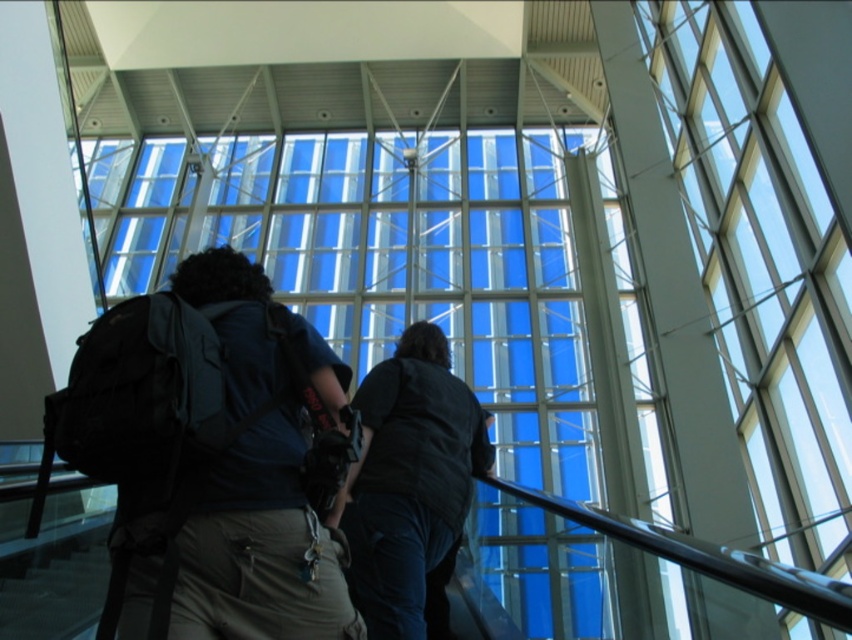
Can you confirm if dark blue fabric backpack at center is thinner than dark blue shirt at center?

No.

Describe the element at coordinates (249, 483) in the screenshot. I see `dark blue fabric backpack at center` at that location.

Locate an element on the screen. dark blue fabric backpack at center is located at coordinates (249, 483).

Between transparent glass window at upper right and dark blue fabric backpack at center, which one has less height?

transparent glass window at upper right is shorter.

Based on the photo, which is below, transparent glass window at upper right or dark blue fabric backpack at center?

dark blue fabric backpack at center is lower down.

Find the location of a particular element. This screenshot has height=640, width=852. transparent glass window at upper right is located at coordinates tap(763, 268).

The height and width of the screenshot is (640, 852). I want to click on transparent glass window at upper right, so click(763, 268).

Does transparent glass window at upper right have a lesser width compared to dark blue shirt at center?

Indeed, transparent glass window at upper right has a lesser width compared to dark blue shirt at center.

Does transparent glass window at upper right come behind dark blue shirt at center?

Yes.

Find the location of a particular element. transparent glass window at upper right is located at coordinates (763, 268).